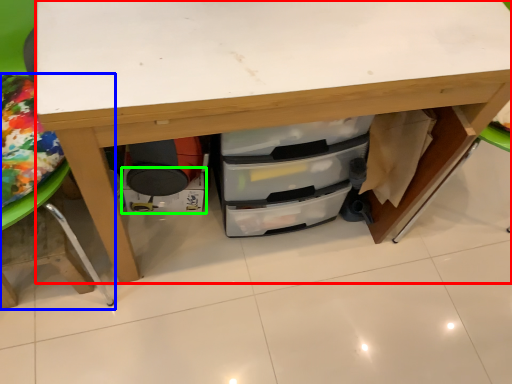
Question: Which object is positioned farthest from desk (highlighted by a red box)? Select from furniture (highlighted by a blue box) and drawer (highlighted by a green box).

Choices:
 (A) furniture
 (B) drawer

Answer: (B)